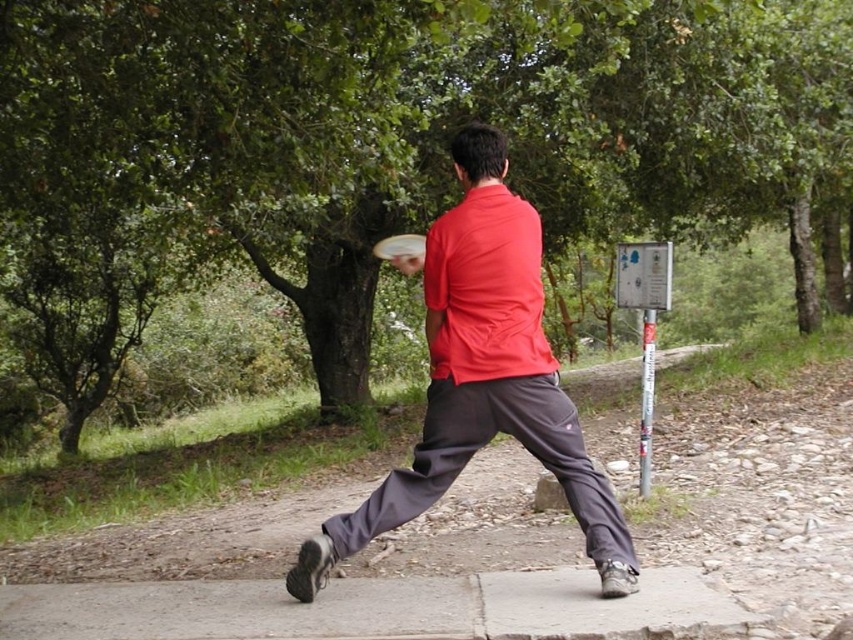
Question: Estimate the real-world distances between objects in this image. Which object is farther from the white plastic frisbee at center?

Choices:
 (A) matte red shirt at center
 (B) green leafy tree at center
 (C) gray concrete pavement at lower center

Answer: (B)

Question: Which point appears closest to the camera in this image?

Choices:
 (A) (540, 412)
 (B) (321, 148)
 (C) (277, 630)
 (D) (376, 248)

Answer: (C)

Question: Which point is closer to the camera?

Choices:
 (A) (408, 240)
 (B) (177, 67)
 (C) (590, 576)

Answer: (C)

Question: Considering the relative positions of green leafy tree at center and matte red shirt at center in the image provided, where is green leafy tree at center located with respect to matte red shirt at center?

Choices:
 (A) below
 (B) above

Answer: (B)

Question: Is matte red shirt at center wider than gray concrete pavement at lower center?

Choices:
 (A) yes
 (B) no

Answer: (B)

Question: Is green leafy tree at center to the left of gray concrete pavement at lower center from the viewer's perspective?

Choices:
 (A) yes
 (B) no

Answer: (A)